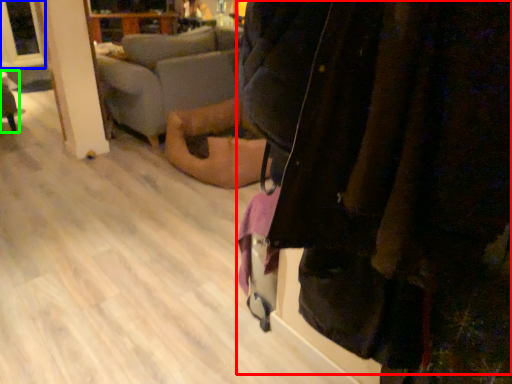
Question: Estimate the real-world distances between objects in this image. Which object is closer to jacket (highlighted by a red box), window screen (highlighted by a blue box) or furniture (highlighted by a green box)?

Choices:
 (A) window screen
 (B) furniture

Answer: (A)